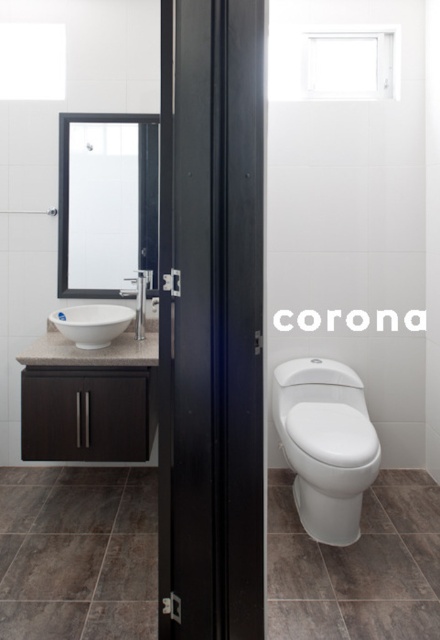
Question: Among these points, which one is nearest to the camera?

Choices:
 (A) (110, 205)
 (B) (77, 342)

Answer: (B)

Question: Which of these objects is positioned farthest from the matte silver faucet at upper left?

Choices:
 (A) white glossy sink at left
 (B) clear glass mirror at upper left
 (C) matte brown cabinet at left
 (D) white glossy toilet at center

Answer: (D)

Question: Does white glossy toilet at center have a larger size compared to white glossy sink at left?

Choices:
 (A) yes
 (B) no

Answer: (A)

Question: Can you confirm if white glossy toilet at center is positioned to the right of matte silver faucet at upper left?

Choices:
 (A) yes
 (B) no

Answer: (A)

Question: Which is farther from the matte silver faucet at upper left?

Choices:
 (A) clear glass mirror at upper left
 (B) white glossy toilet at center

Answer: (B)

Question: Can you confirm if clear glass mirror at upper left is thinner than white glossy toilet at center?

Choices:
 (A) yes
 (B) no

Answer: (B)